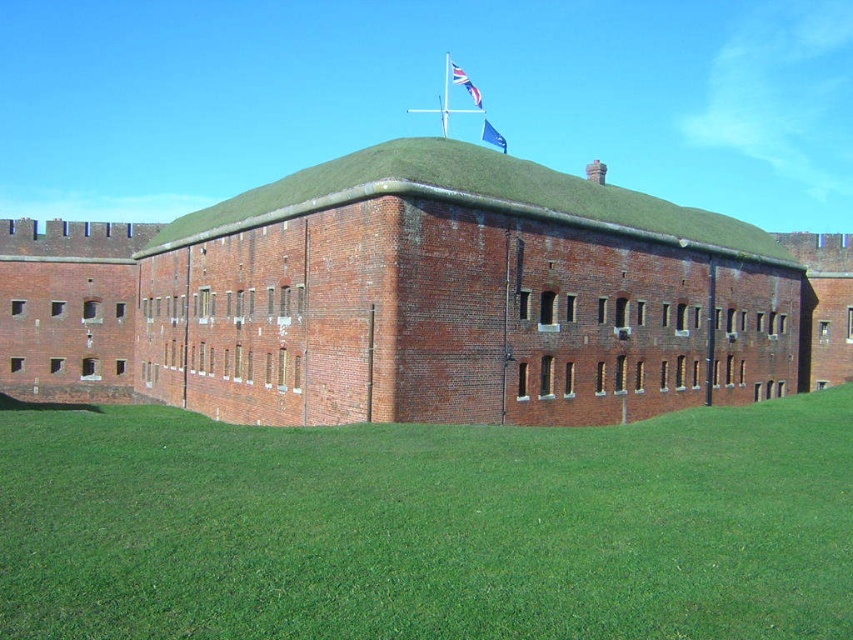
Is green grassy roof at center above union jack fabric flag at upper center?

Incorrect, green grassy roof at center is not positioned above union jack fabric flag at upper center.

Is green grassy roof at center to the left of union jack fabric flag at upper center from the viewer's perspective?

Correct, you'll find green grassy roof at center to the left of union jack fabric flag at upper center.

Between point (187, 212) and point (451, 67), which one is positioned in front?

Point (451, 67)

This screenshot has height=640, width=853. I want to click on green grassy roof at center, so click(x=474, y=198).

Does point (836, 525) come farther from viewer compared to point (683, 228)?

No.

How much distance is there between green grass at lower center and green grassy roof at center?

They are 14.73 meters apart.

Is point (614, 516) positioned behind point (450, 168)?

No, (614, 516) is closer to viewer.

You are a GUI agent. You are given a task and a screenshot of the screen. Output one action in this format:
    pyautogui.click(x=<x>, y=<y>)
    Task: Click on the green grass at lower center
    The height and width of the screenshot is (640, 853).
    Given the screenshot: What is the action you would take?
    pyautogui.click(x=427, y=525)

Between red brick building at center and blue fabric flag at center, which one is positioned higher?

blue fabric flag at center is above.

You are a GUI agent. You are given a task and a screenshot of the screen. Output one action in this format:
    pyautogui.click(x=<x>, y=<y>)
    Task: Click on the red brick building at center
    
    Given the screenshot: What is the action you would take?
    pyautogui.click(x=419, y=300)

Does point (548, 243) come behind point (503, 144)?

No, (548, 243) is closer to viewer.

The height and width of the screenshot is (640, 853). Find the location of `red brick building at center`. red brick building at center is located at coordinates (419, 300).